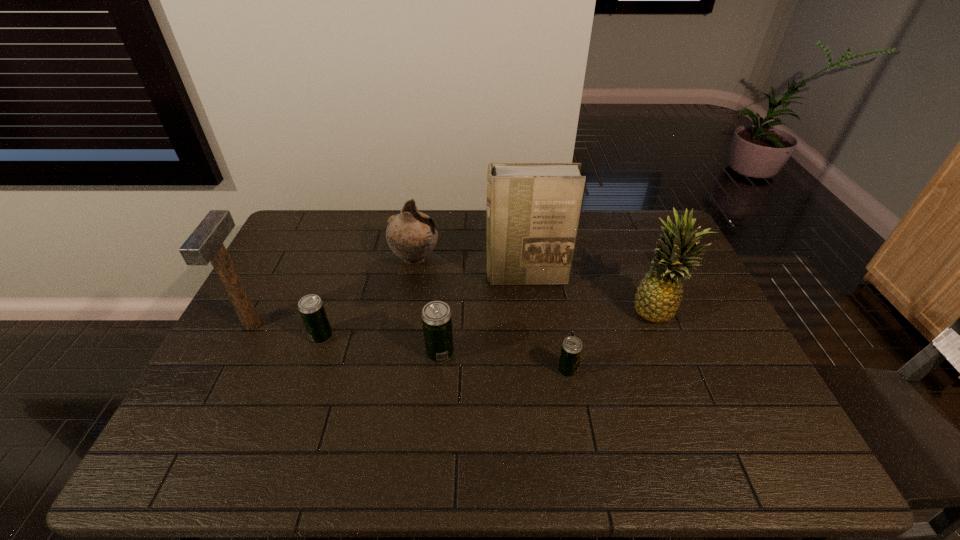
This screenshot has width=960, height=540. In order to click on free space that satisfies the following two spatial constraints: 1. on the cover of the phonebook; 2. on the left side of the pineapple in this screenshot , I will do `click(530, 310)`.

At what (x,y) coordinates should I click in order to perform the action: click on vacant region that satisfies the following two spatial constraints: 1. from the spout of the fourth shortest object; 2. on the left side of the shortest beer can. Please return your answer as a coordinate pair (x, y). Looking at the image, I should click on (396, 370).

Where is `vacant space that satisfies the following two spatial constraints: 1. on the front side of the second beer can from left to right; 2. on the left side of the shortest object`? This screenshot has height=540, width=960. vacant space that satisfies the following two spatial constraints: 1. on the front side of the second beer can from left to right; 2. on the left side of the shortest object is located at coordinates (439, 370).